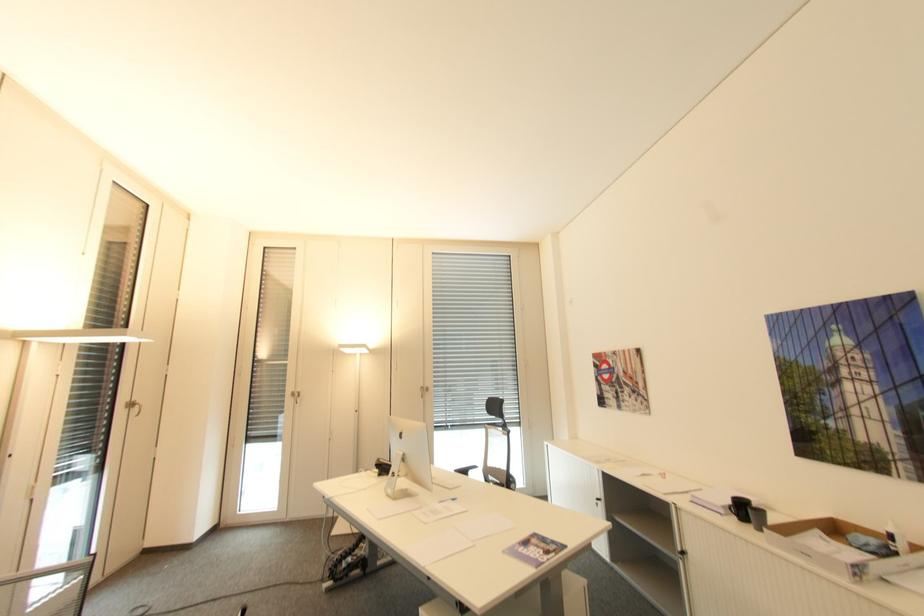
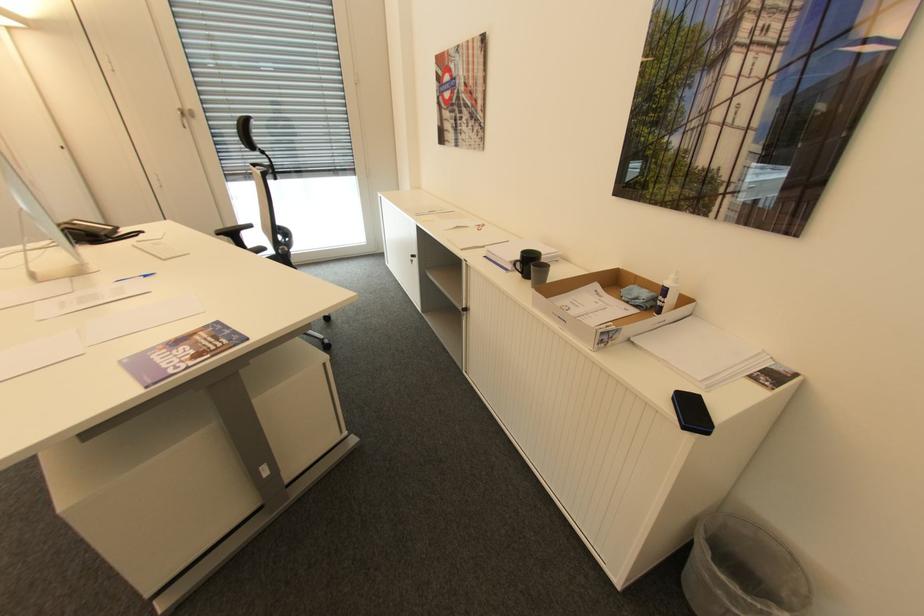
Where in the second image is the point corresponding to (x=895, y=537) from the first image?

(670, 291)